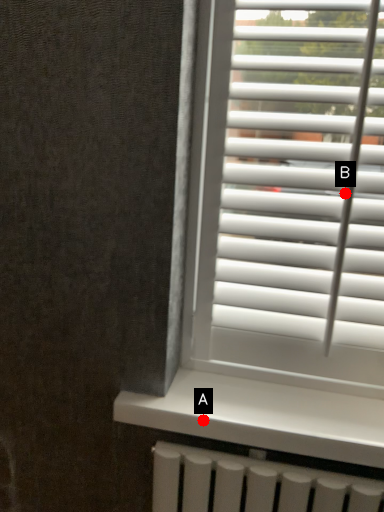
Question: Two points are circled on the image, labeled by A and B beside each circle. Which point is farther from the camera taking this photo?

Choices:
 (A) A is further
 (B) B is further

Answer: (A)